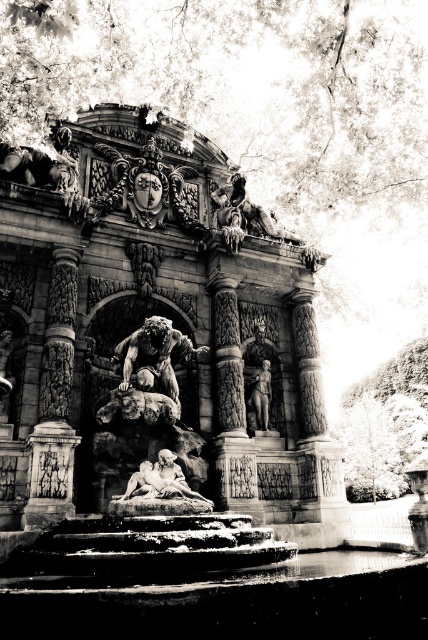
Question: Estimate the real-world distances between objects in this image. Which object is farther from the matte stone sculpture at center?

Choices:
 (A) carved stone fountain at center
 (B) polished bronze statue at center

Answer: (B)

Question: Which of these objects is positioned closest to the carved stone column at left?

Choices:
 (A) matte stone sculpture at center
 (B) polished bronze statue at center

Answer: (A)

Question: Can you confirm if carved stone column at left is positioned above matte stone sculpture at center?

Choices:
 (A) no
 (B) yes

Answer: (B)

Question: Among these objects, which one is nearest to the camera?

Choices:
 (A) matte stone sculpture at center
 (B) carved stone fountain at center

Answer: (B)

Question: Is carved stone fountain at center wider than carved stone column at left?

Choices:
 (A) no
 (B) yes

Answer: (B)

Question: Does carved stone fountain at center come behind polished bronze statue at center?

Choices:
 (A) no
 (B) yes

Answer: (A)